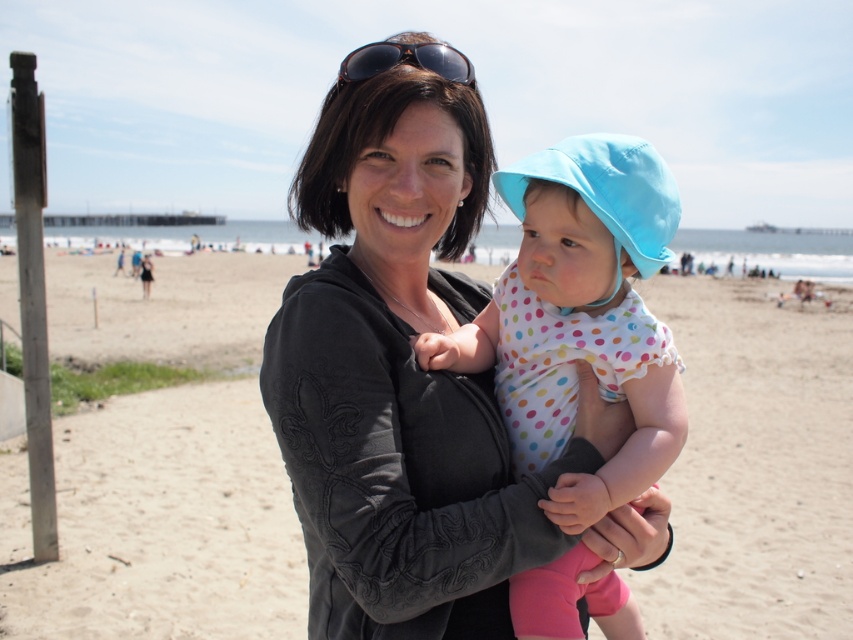
Question: Which of these objects is positioned farthest from the polka dot fabric sunsuit at center?

Choices:
 (A) brown textured sunglasses at upper center
 (B) beige sand at center

Answer: (B)

Question: Does beige sand at center appear over brown textured sunglasses at upper center?

Choices:
 (A) yes
 (B) no

Answer: (B)

Question: Which is farther from the brown textured sunglasses at upper center?

Choices:
 (A) polka dot fabric sunsuit at center
 (B) beige sand at center

Answer: (B)

Question: Is beige sand at center smaller than brown textured sunglasses at upper center?

Choices:
 (A) no
 (B) yes

Answer: (A)

Question: Which point is farther to the camera?

Choices:
 (A) (508, 296)
 (B) (689, 440)
 (C) (468, 67)

Answer: (B)

Question: Is beige sand at center wider than polka dot fabric sunsuit at center?

Choices:
 (A) no
 (B) yes

Answer: (B)